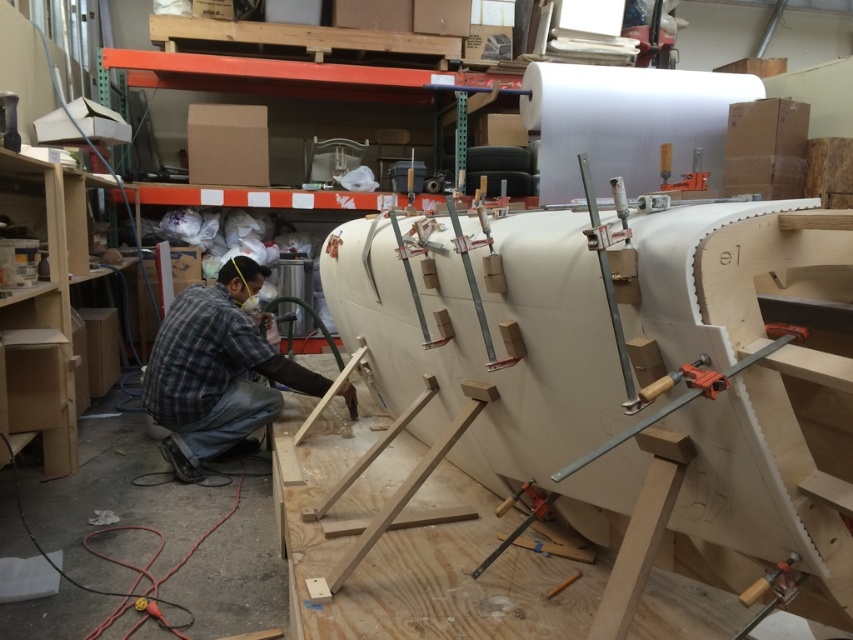
Can you confirm if plaid fabric shirt at lower left is positioned to the left of metallic clamp at upper right?

Yes, plaid fabric shirt at lower left is to the left of metallic clamp at upper right.

Based on the photo, is plaid fabric shirt at lower left bigger than metallic clamp at upper right?

Correct, plaid fabric shirt at lower left is larger in size than metallic clamp at upper right.

Is point (254, 368) farther from viewer compared to point (697, 176)?

Yes, it is behind point (697, 176).

The width and height of the screenshot is (853, 640). Identify the location of plaid fabric shirt at lower left. (218, 371).